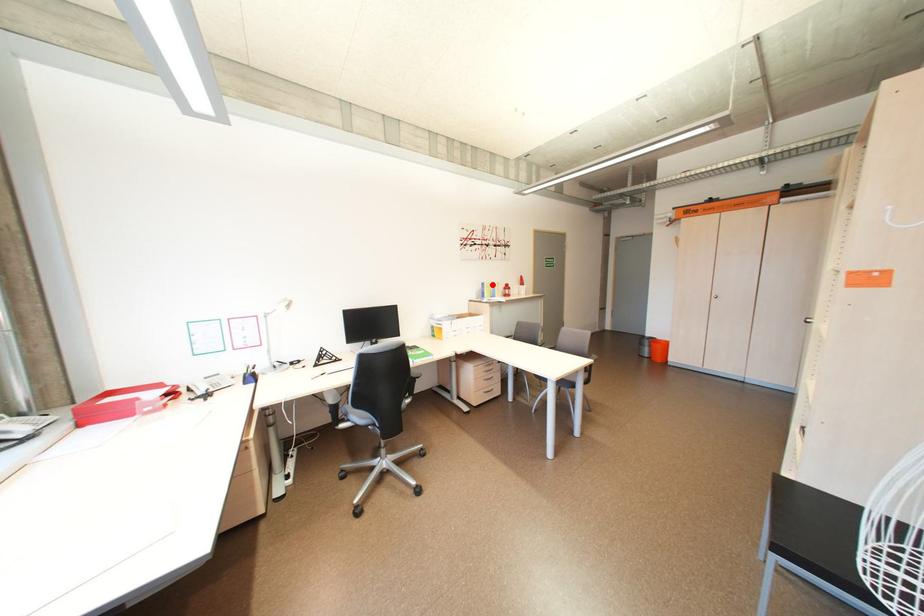
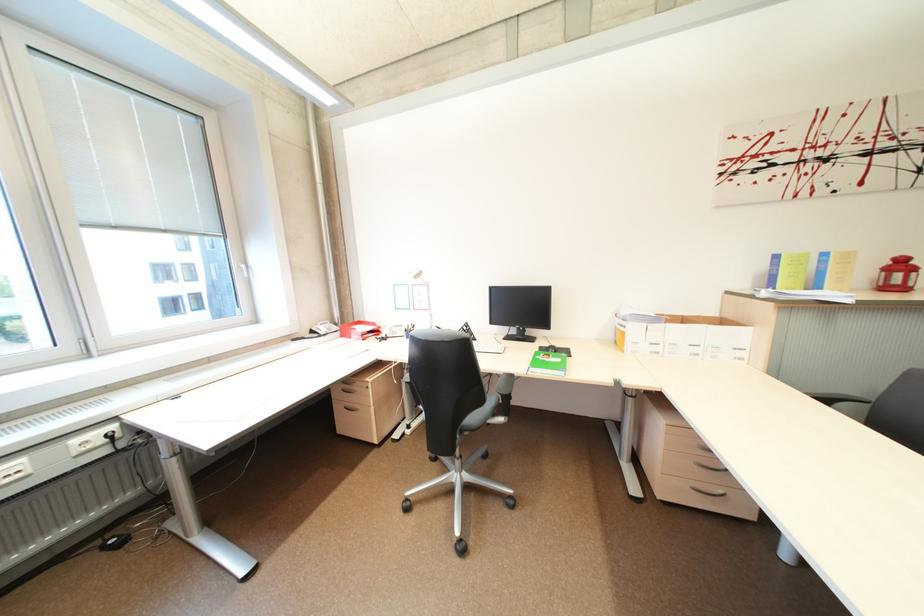
Locate, in the second image, the point that corresponds to the highlighted location in the first image.

(785, 257)